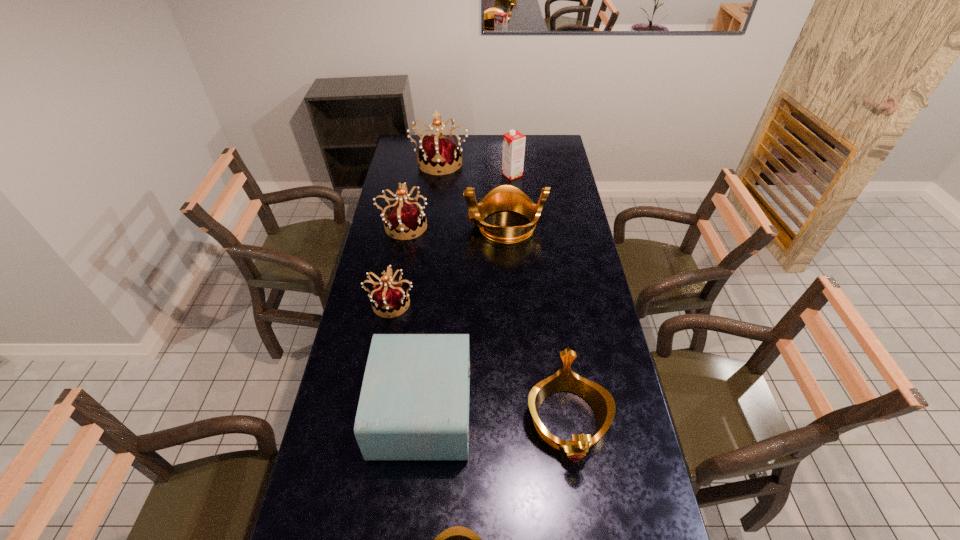
Find the location of a particular element. vacant area situated on the front-facing side of the tallest object is located at coordinates click(x=438, y=182).

At what (x,y) coordinates should I click in order to perform the action: click on vacant space located 0.330m on the front of the carton. Please return your answer as a coordinate pair (x, y). Looking at the image, I should click on (516, 222).

The height and width of the screenshot is (540, 960). Find the location of `vacant space positioned on the front-facing side of the second farthest red tiara`. vacant space positioned on the front-facing side of the second farthest red tiara is located at coordinates (507, 226).

Locate an element on the screen. free space located at the front emblem of the biggest gold tiara is located at coordinates (453, 226).

Where is `free location located at the front emblem of the biggest gold tiara`? The image size is (960, 540). free location located at the front emblem of the biggest gold tiara is located at coordinates (448, 226).

Identify the location of free location located at the front emblem of the biggest gold tiara. (407, 226).

The height and width of the screenshot is (540, 960). Identify the location of free location located 0.350m on the front panel of the radio receiver. (586, 410).

This screenshot has width=960, height=540. Find the location of `blank space located 0.080m on the front-facing side of the fifth farthest object`. blank space located 0.080m on the front-facing side of the fifth farthest object is located at coordinates (384, 338).

Locate an element on the screen. Image resolution: width=960 pixels, height=540 pixels. blank space located 0.050m at the front emblem of the second smallest gold tiara is located at coordinates (578, 491).

The image size is (960, 540). In order to click on object at the far edge in this screenshot , I will do `click(440, 153)`.